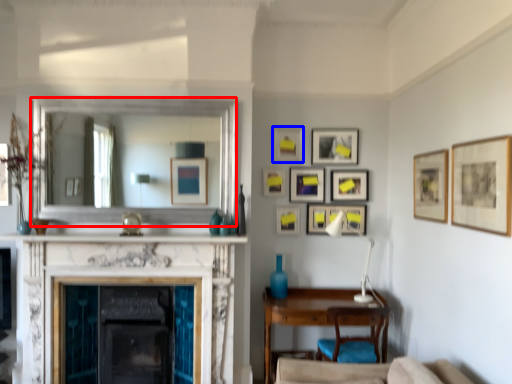
Question: Which point is closer to the camera, mirror (highlighted by a red box) or picture frame (highlighted by a blue box)?

Choices:
 (A) mirror
 (B) picture frame

Answer: (A)